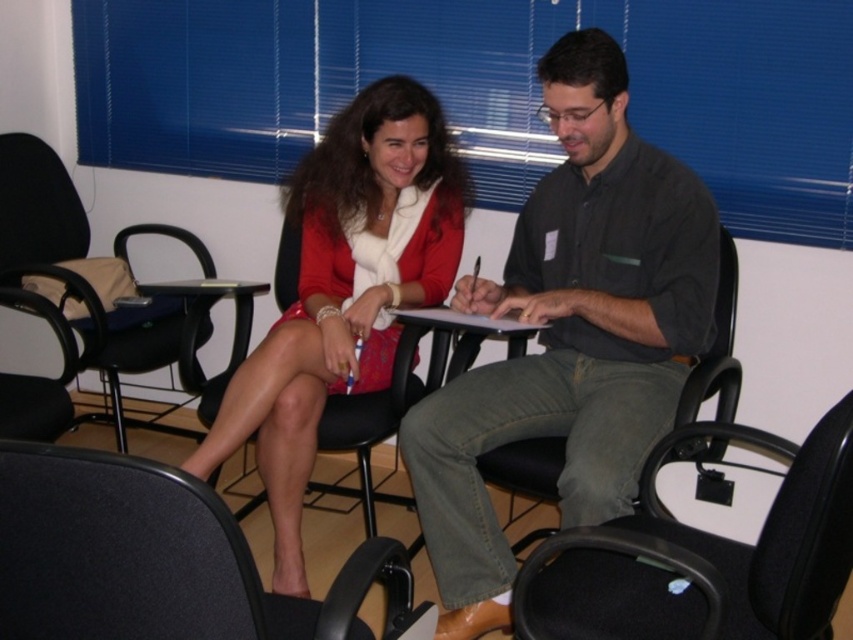
You are a photographer setting up for a group photo in this conference room. You need to ensure that the dark gray shirt at center and the black fabric swivel chair at center are both visible in the frame. Based on their sizes, which object should you focus on first to ensure proper framing?

The dark gray shirt at center is taller than the black fabric swivel chair at center, so you should focus on the dark gray shirt at center first to ensure proper framing.

Consider the image. You are standing at the entrance of the conference room and see two points marked in the scene. The first point is at coordinates point (x=473, y=289) and the second is at point (x=727, y=266). Which point is closer to you?

Point (x=473, y=289) is in front of point (x=727, y=266), so it is closer to you.

Based on the photo, you are standing in the conference room and want to place a small plant between the two points labeled as point (541, 240) and point (654, 557). Since the plant needs to be closer to the camera, which point should you use as the reference for placement?

You should place the plant closer to point (541, 240) because it is further to the camera than point (654, 557), making it the closer point to the camera.